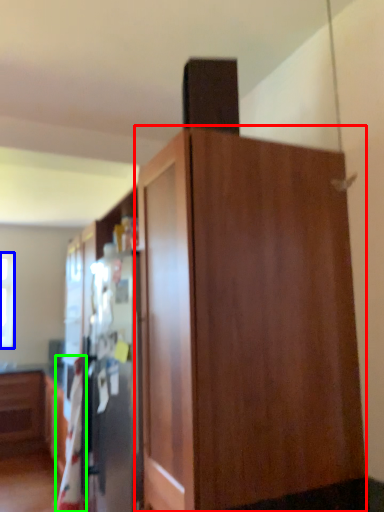
Question: Estimate the real-world distances between objects in this image. Which object is farther from cupboard (highlighted by a red box), window (highlighted by a blue box) or blanket (highlighted by a green box)?

Choices:
 (A) window
 (B) blanket

Answer: (A)